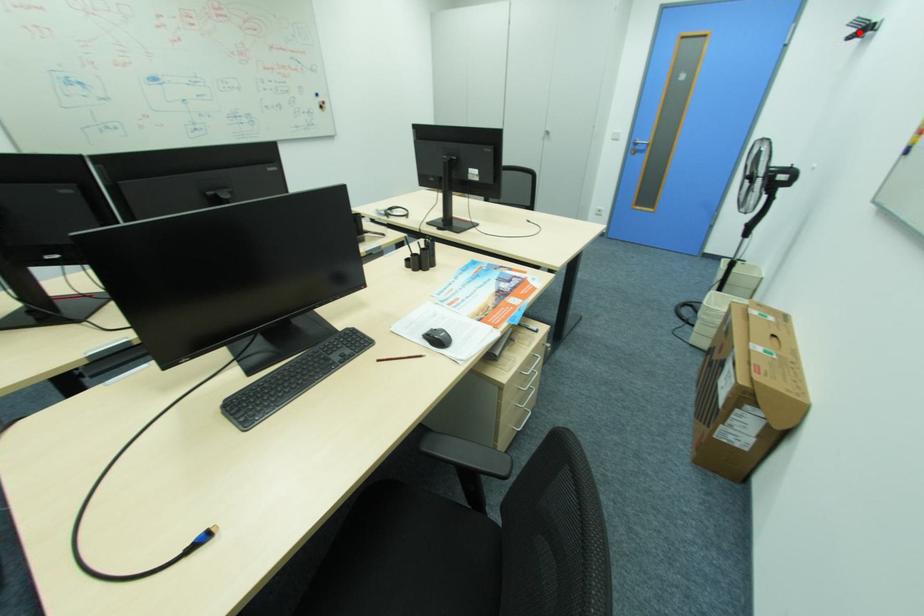
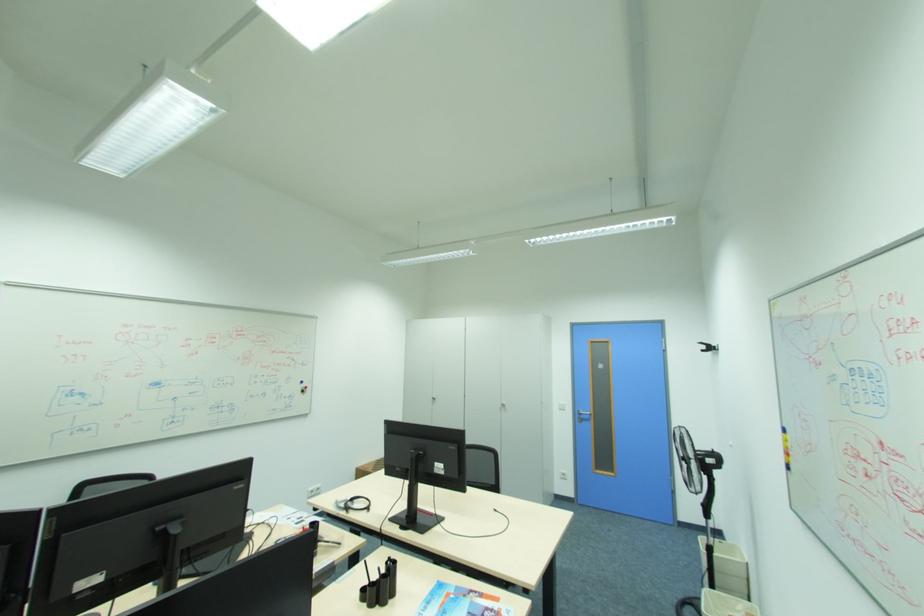
The point at the highlighted location is marked in the first image. Where is the corresponding point in the second image?

(708, 347)